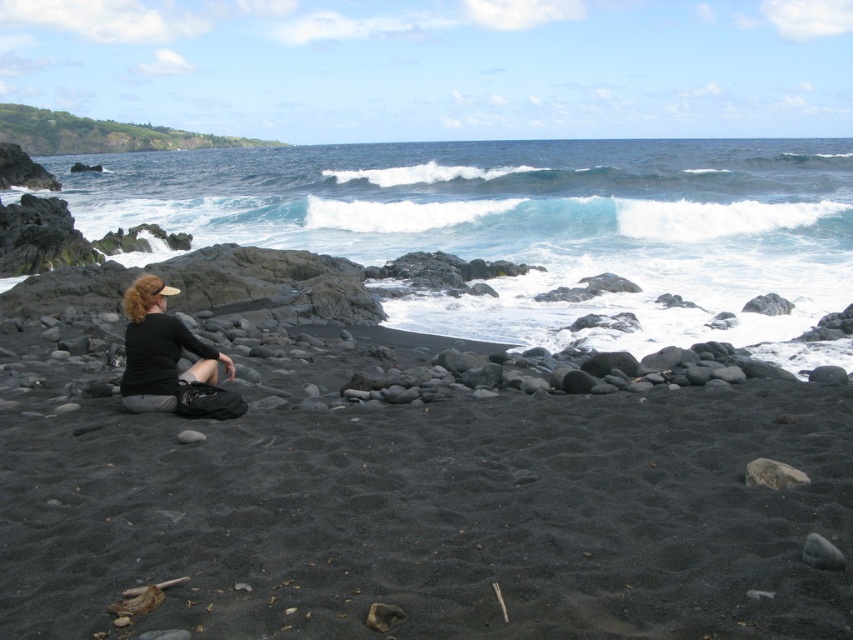
Does gray smooth rock at lower right have a lesser width compared to smooth gray rock at center?

Incorrect, gray smooth rock at lower right's width is not less than smooth gray rock at center's.

Who is positioned more to the left, gray smooth rock at lower right or smooth gray rock at center?

Positioned to the left is smooth gray rock at center.

The width and height of the screenshot is (853, 640). What do you see at coordinates (773, 474) in the screenshot? I see `gray smooth rock at lower right` at bounding box center [773, 474].

Locate an element on the screen. gray smooth rock at lower right is located at coordinates (773, 474).

Can you confirm if matte black shirt at center is bigger than gray smooth rock at lower right?

Correct, matte black shirt at center is larger in size than gray smooth rock at lower right.

Is matte black shirt at center thinner than gray smooth rock at lower right?

No, matte black shirt at center is not thinner than gray smooth rock at lower right.

Find the location of a particular element. The height and width of the screenshot is (640, 853). matte black shirt at center is located at coordinates (160, 349).

Is point (199, 355) positioned before point (817, 564)?

No, it is behind (817, 564).

Does matte black shirt at center have a lesser width compared to smooth gray rock at center?

Incorrect, matte black shirt at center's width is not less than smooth gray rock at center's.

Identify the location of matte black shirt at center. (160, 349).

Where is `matte black shirt at center`? matte black shirt at center is located at coordinates (160, 349).